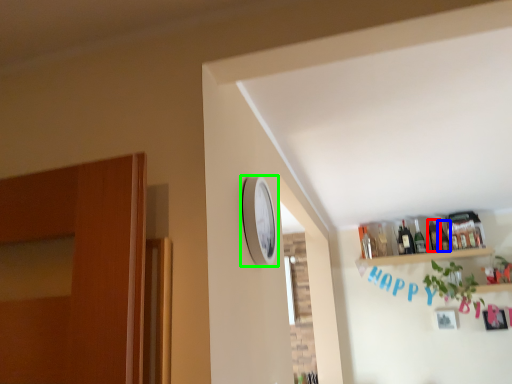
Question: Which object is positioned closest to bottle (highlighted by a red box)? Select from bottle (highlighted by a blue box) and clock (highlighted by a green box).

Choices:
 (A) bottle
 (B) clock

Answer: (A)